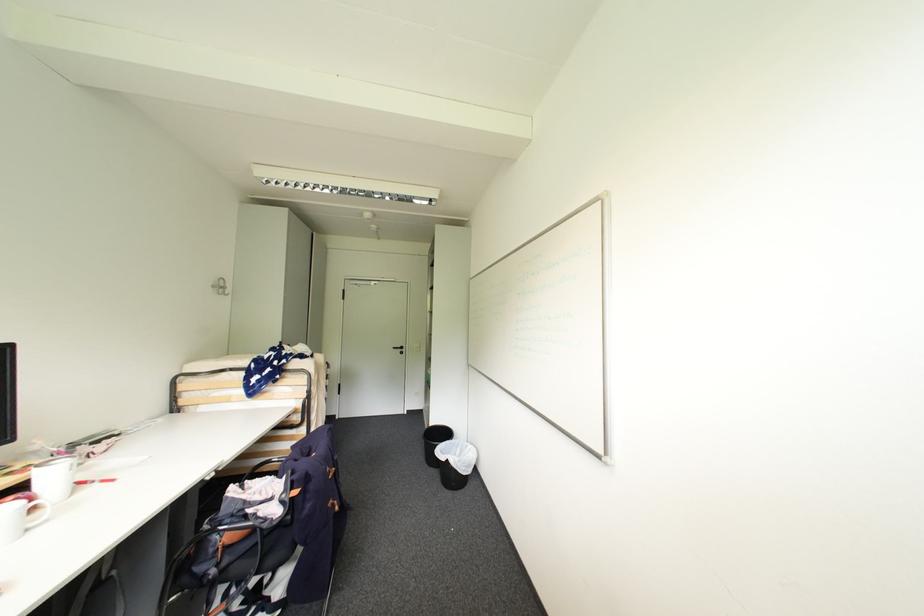
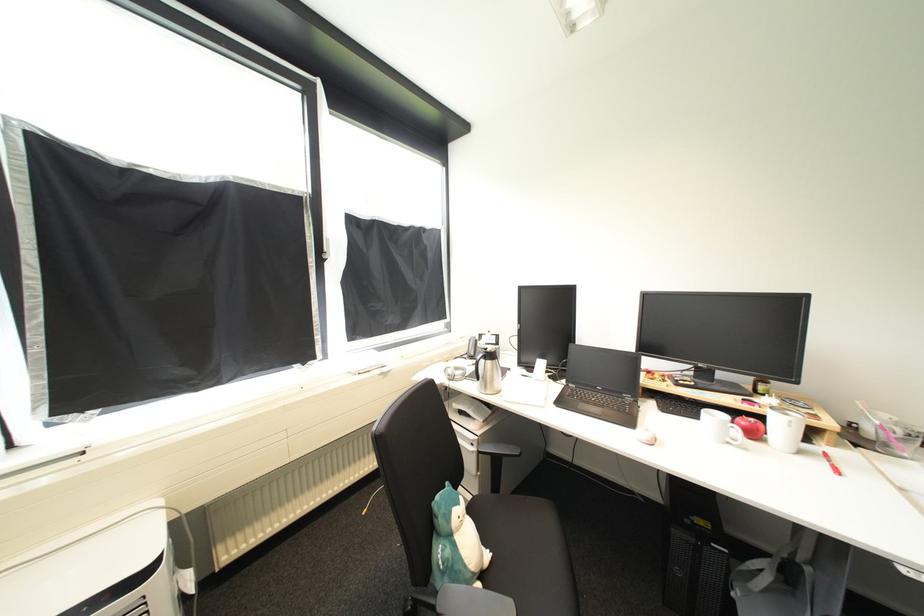
In the second image, find the point that corresponds to the point at 34,531 in the first image.

(736, 445)